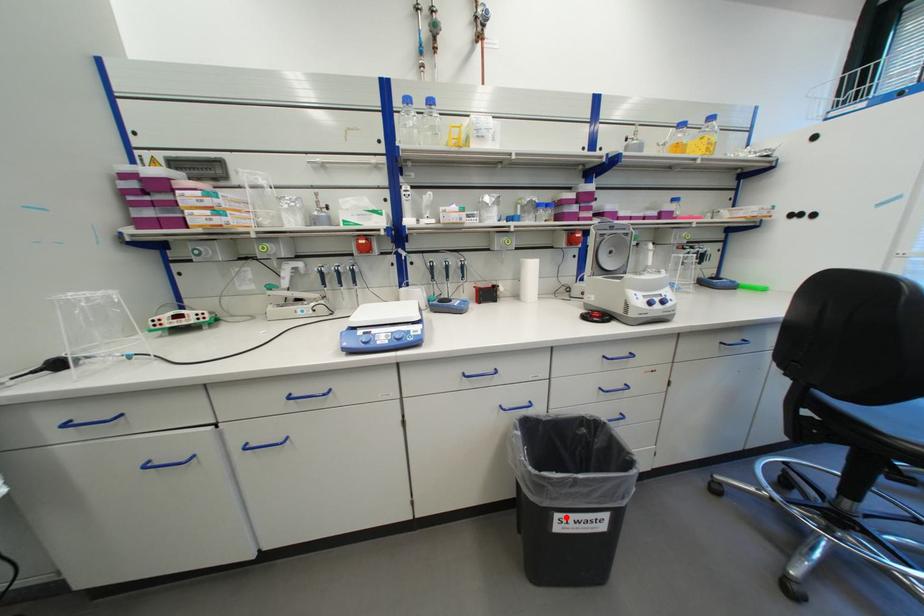
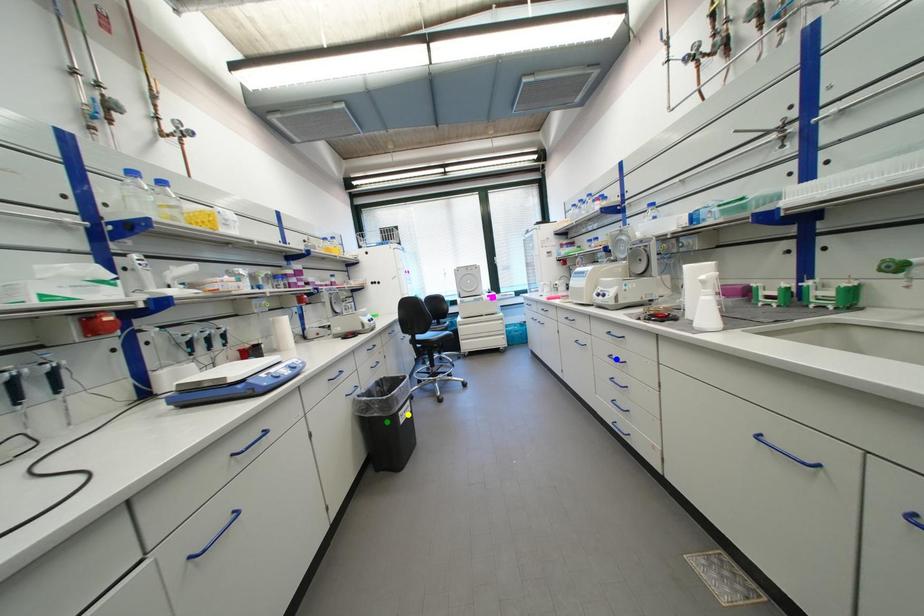
Question: I am providing you with two images of the same scene from different viewpoints. A red point is marked on the first image. You are given multiple points on the second image. In image 2, which mark is for the same physical point as the one in image 1?

Choices:
 (A) green point
 (B) yellow point
 (C) blue point

Answer: (B)